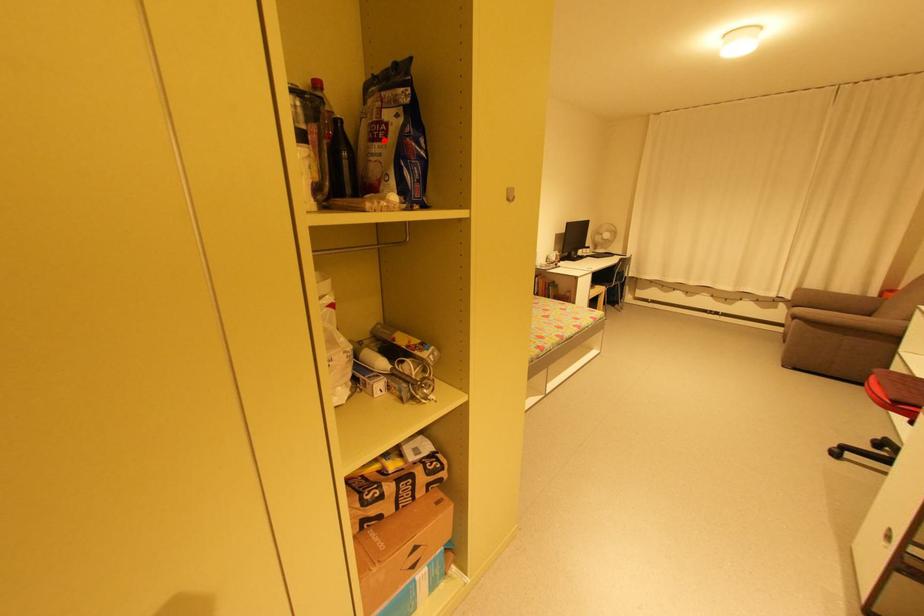
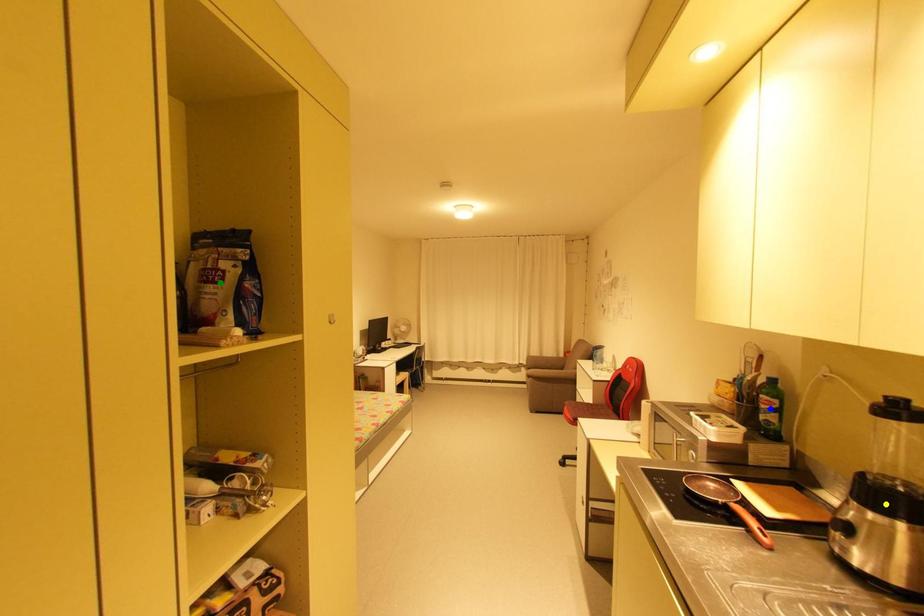
Question: I am providing you with two images of the same scene from different viewpoints. A red point is marked on the first image. You are given multiple points on the second image. Which spot in image 2 lines up with the point in image 1?

Choices:
 (A) yellow point
 (B) blue point
 (C) green point

Answer: (C)